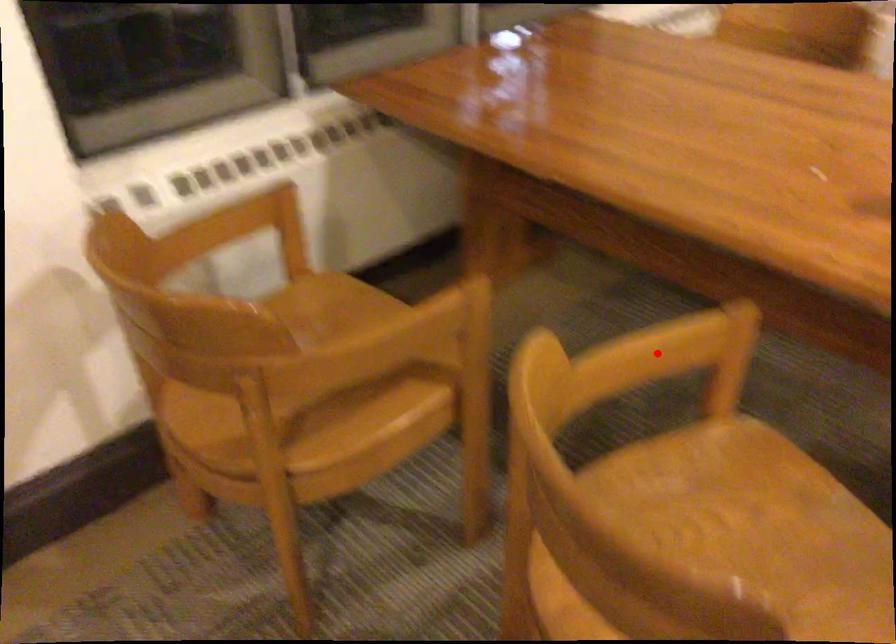
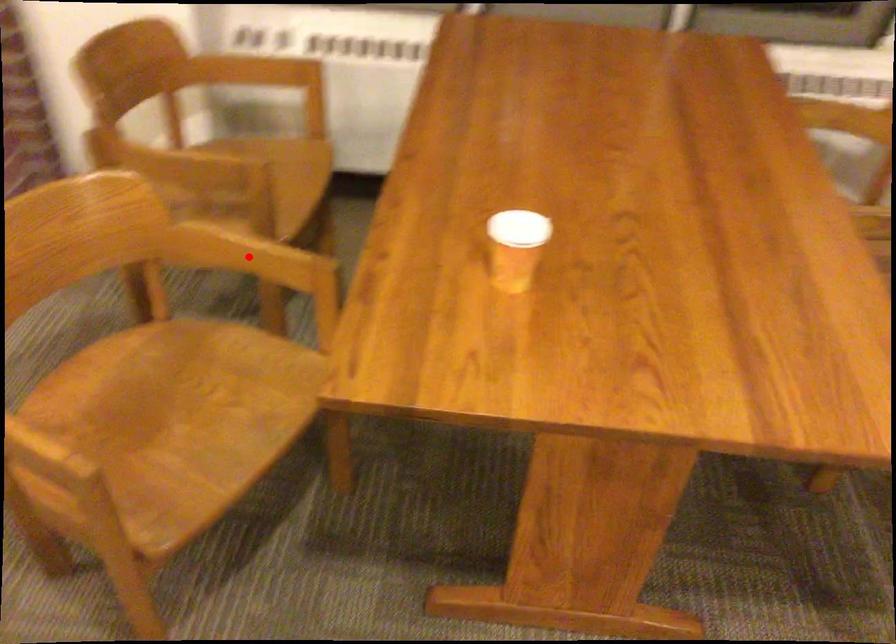
I am providing you with two images of the same scene from different viewpoints. A red point is marked on the first image and another point is marked on the second image. Does the point marked in image1 correspond to the same location as the one in image2?

Yes